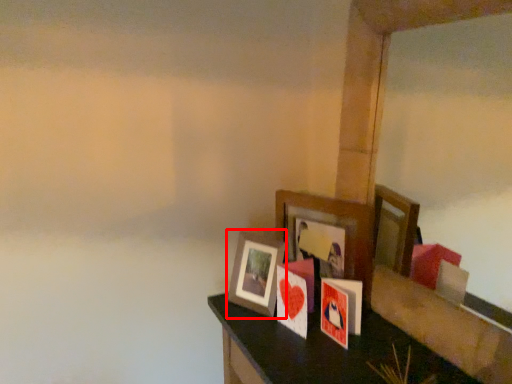
Question: From the image, what is the correct spatial relationship of picture frame (annotated by the red box) in relation to picture frame?

Choices:
 (A) left
 (B) right

Answer: (A)